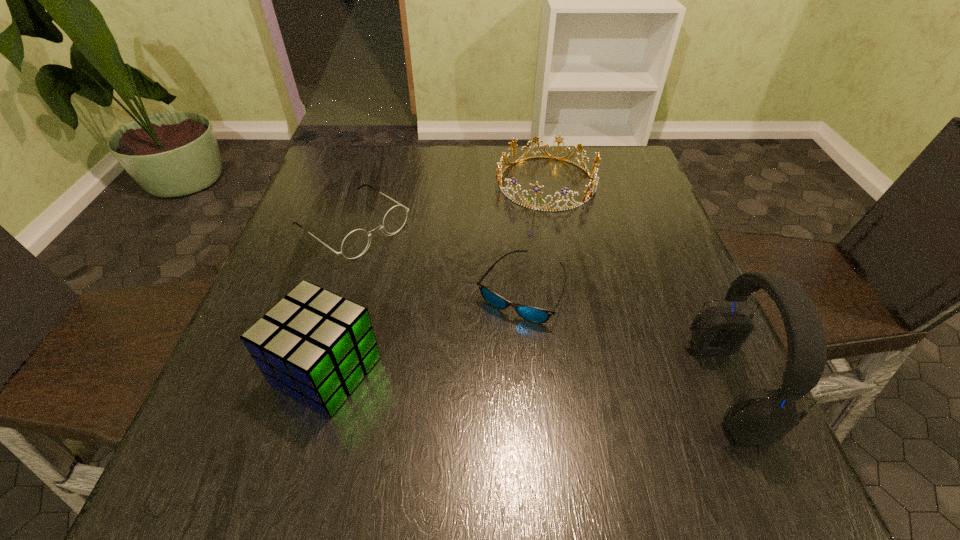
Identify the location of free space at the left edge of the desktop. This screenshot has height=540, width=960. (344, 264).

In the image, there is a desktop. Where is `vacant region at the right edge`? The image size is (960, 540). vacant region at the right edge is located at coordinates (687, 365).

In the image, there is a desktop. In order to click on free space at the far left corner in this screenshot , I will do `click(363, 187)`.

In the image, there is a desktop. In order to click on vacant space at the near left corner in this screenshot , I will do `click(248, 419)`.

Image resolution: width=960 pixels, height=540 pixels. Find the location of `vacant space at the far right corner of the desktop`. vacant space at the far right corner of the desktop is located at coordinates (589, 147).

Locate an element on the screen. The image size is (960, 540). vacant region at the near right corner of the desktop is located at coordinates (731, 393).

Find the location of a particular element. Image resolution: width=960 pixels, height=540 pixels. blank region between the sunglasses and the second shortest object is located at coordinates (437, 259).

Where is `vacant area that lies between the shortest object and the fourth shortest object`? The image size is (960, 540). vacant area that lies between the shortest object and the fourth shortest object is located at coordinates (423, 330).

The image size is (960, 540). I want to click on vacant area that lies between the cube and the shortest object, so (423, 330).

At what (x,y) coordinates should I click in order to perform the action: click on empty location between the tallest object and the shortest object. Please return your answer as a coordinate pair (x, y). The width and height of the screenshot is (960, 540). Looking at the image, I should click on (624, 339).